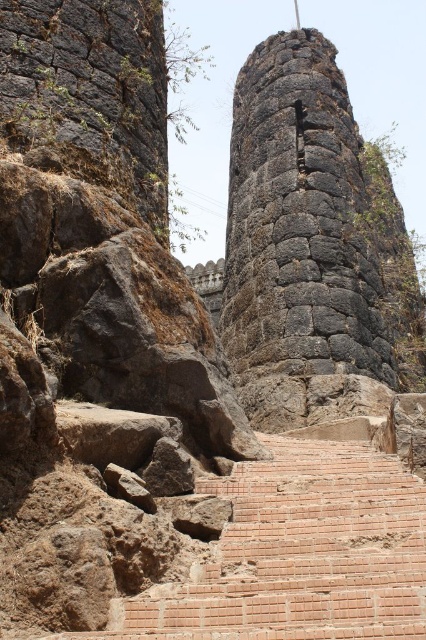
Question: Can you confirm if rough stone tower at center is positioned to the left of brick stairs at lower center?

Choices:
 (A) no
 (B) yes

Answer: (A)

Question: Does rough stone tower at center have a lesser width compared to brick stairs at lower center?

Choices:
 (A) yes
 (B) no

Answer: (B)

Question: Which of the following is the farthest from the observer?

Choices:
 (A) brick stairs at lower center
 (B) rough stone tower at center

Answer: (B)

Question: Considering the relative positions of rough stone tower at center and brick stairs at lower center in the image provided, where is rough stone tower at center located with respect to brick stairs at lower center?

Choices:
 (A) left
 (B) right

Answer: (B)

Question: Which object is farther from the camera taking this photo?

Choices:
 (A) brick stairs at lower center
 (B) rough stone tower at center

Answer: (B)